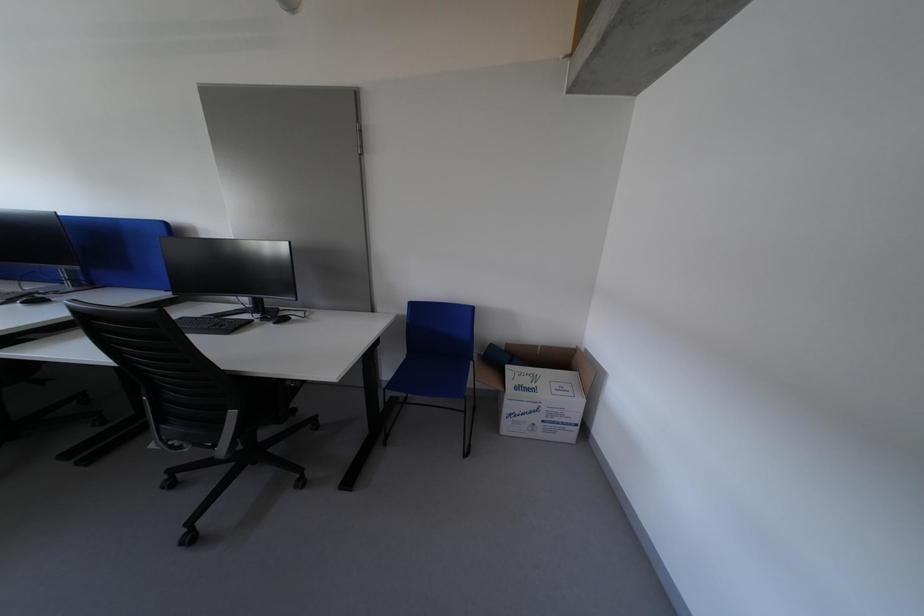
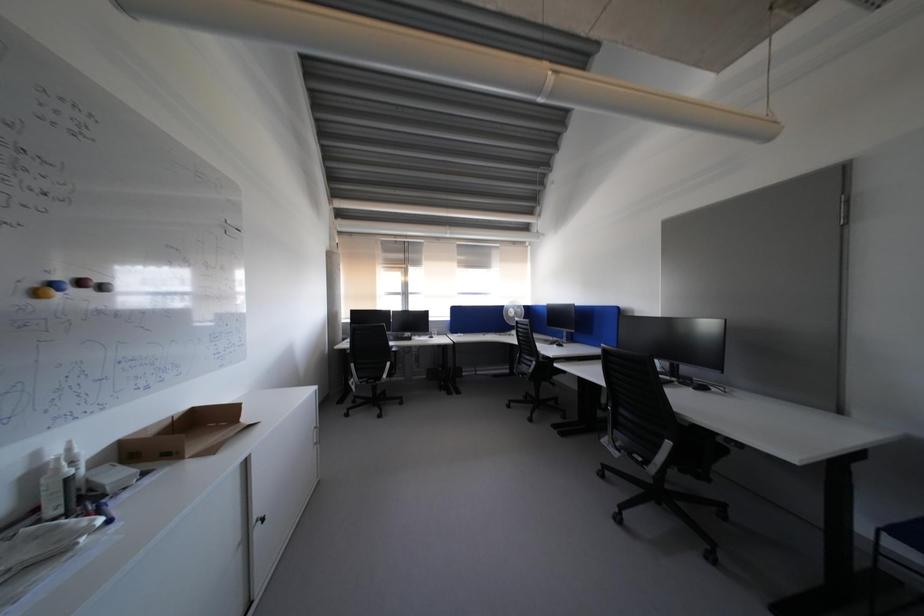
Question: The camera is either moving clockwise (left) or counter-clockwise (right) around the object. The first image is from the beginning of the video and the second image is from the end. Is the camera moving left or right when shooting the video?

Choices:
 (A) Left
 (B) Right

Answer: (B)